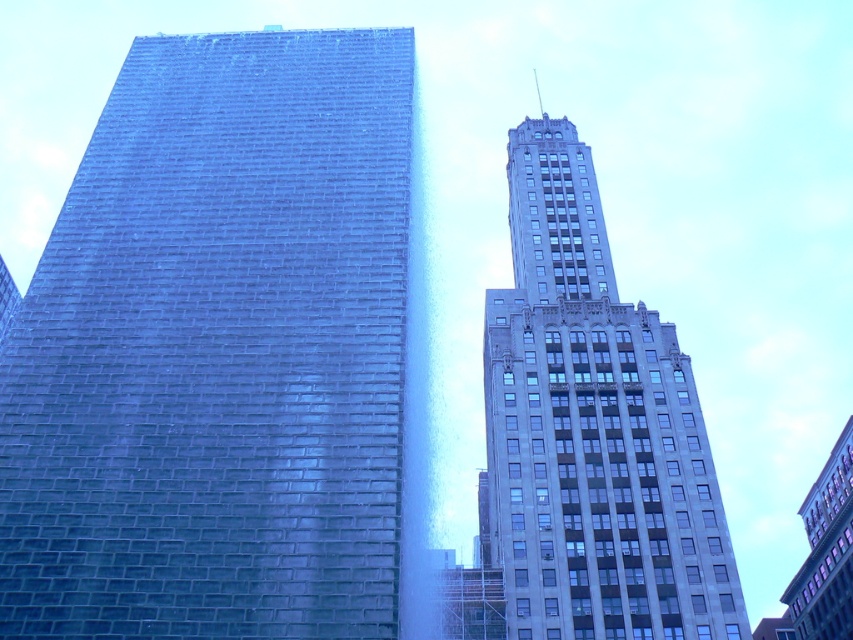
Question: Can you confirm if smooth glass tower at left is positioned below gray stone tower at upper right?

Choices:
 (A) no
 (B) yes

Answer: (A)

Question: Is smooth glass tower at left smaller than gray stone tower at upper right?

Choices:
 (A) yes
 (B) no

Answer: (B)

Question: Is smooth glass tower at left bigger than gray stone tower at upper right?

Choices:
 (A) no
 (B) yes

Answer: (B)

Question: Among these objects, which one is farthest from the camera?

Choices:
 (A) gray stone tower at upper right
 (B) smooth glass tower at left

Answer: (A)